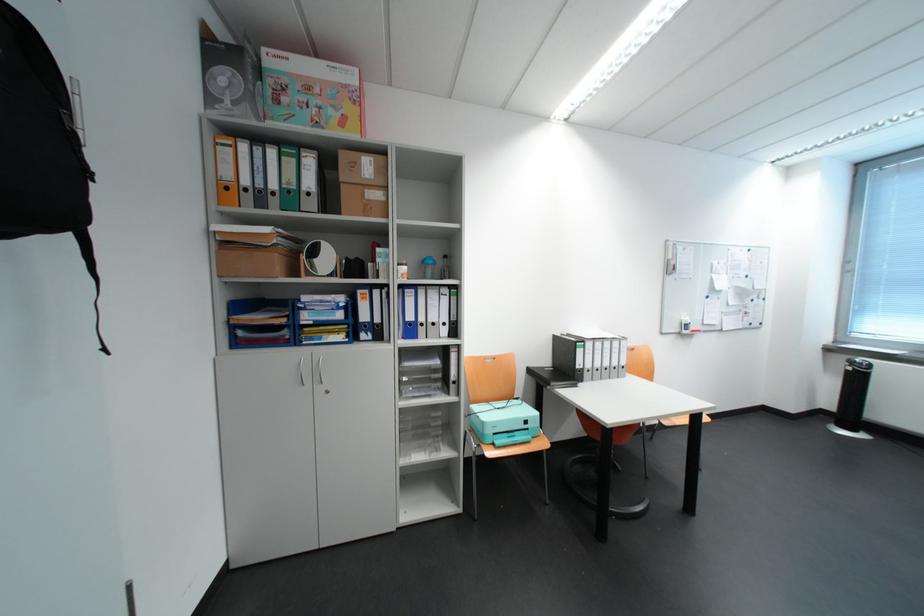
Find the location of a particular element. black cylindrical fan is located at coordinates (x=225, y=87).